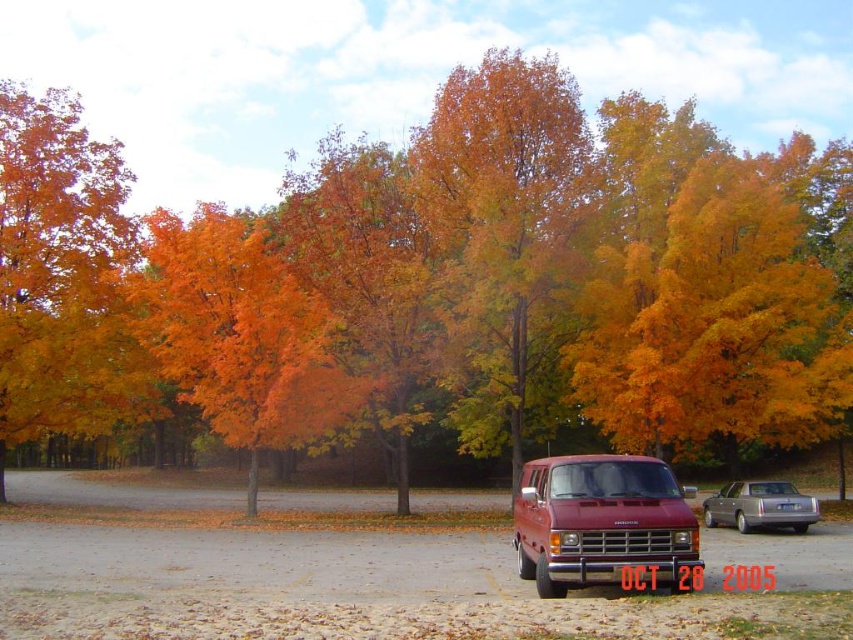
What is the name of the object located at coordinates point (x=440, y=288)?

The object at point (x=440, y=288) is the orange leafy tree at center.

You are standing in the autumn park scene and want to walk from the golden textured leaves at center to the metallic gray sedan at center right. Which direction should you move to get closer to the sedan?

You should move backward because the golden textured leaves at center are closer to you than the metallic gray sedan at center right, so moving backward would take you towards the sedan.

You are planning to place a picnic blanket between the orange leafy tree at center and the golden textured leaves at center. Given that the picnic blanket requires 20 feet of space, will there be enough room?

The orange leafy tree at center and golden textured leaves at center are 19.60 feet apart from each other. Since the required space is 20 feet, there is insufficient room for the picnic blanket.